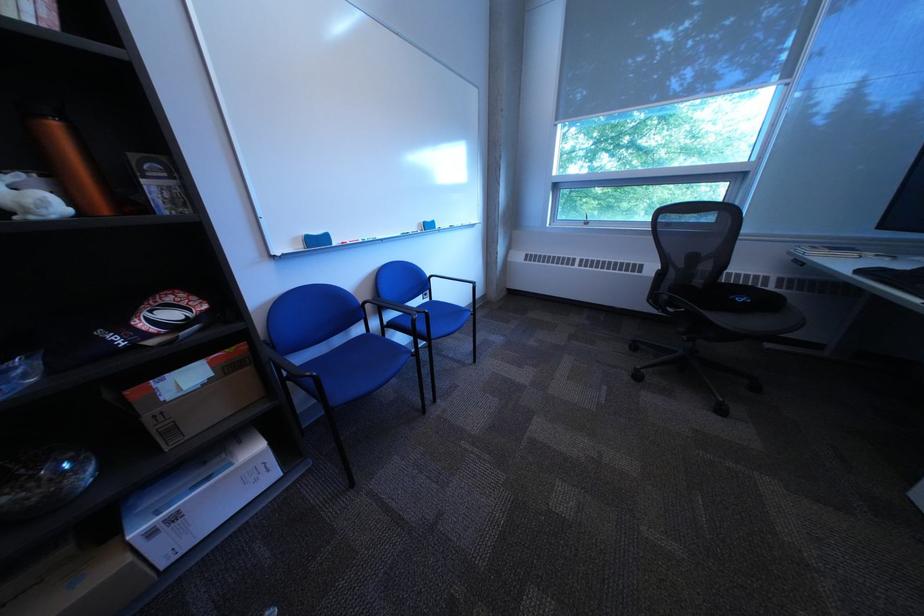
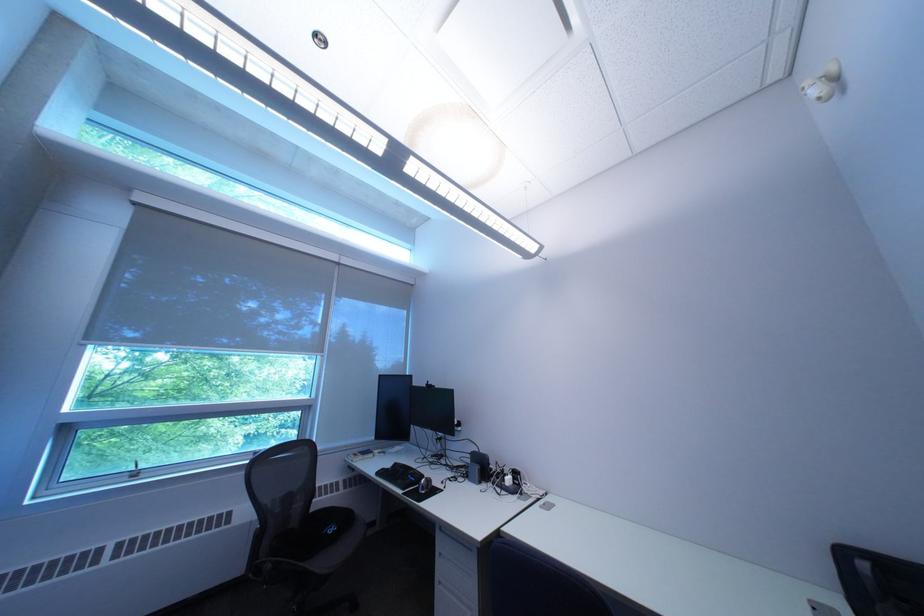
In the second image, find the point that corresponds to (x=681, y=299) in the first image.

(285, 568)